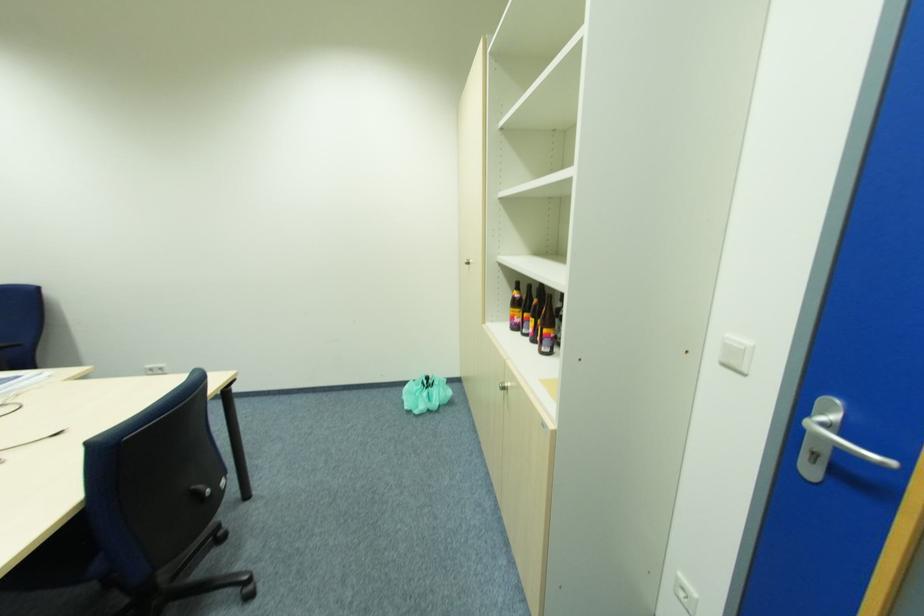
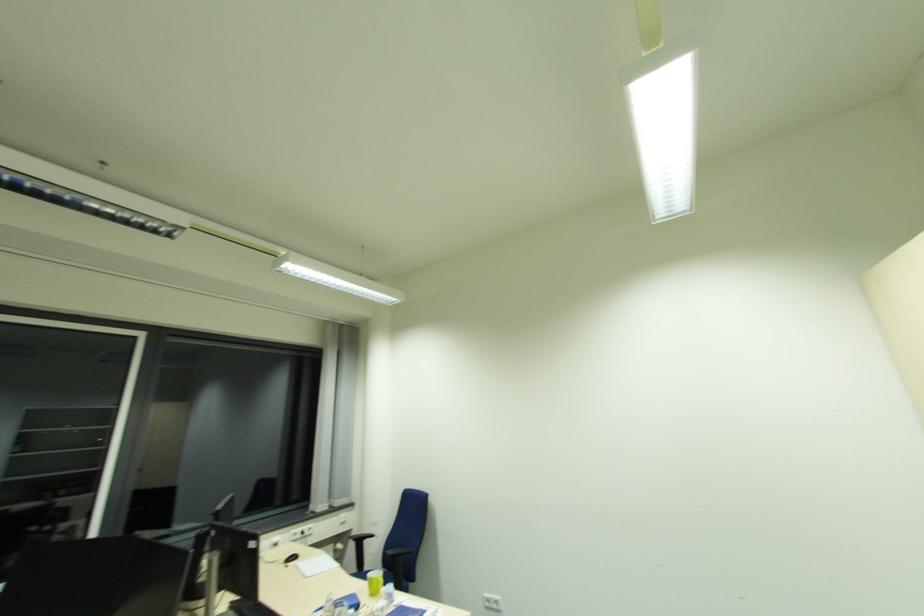
How did the camera likely rotate?

The rotation direction of the camera is left-up.